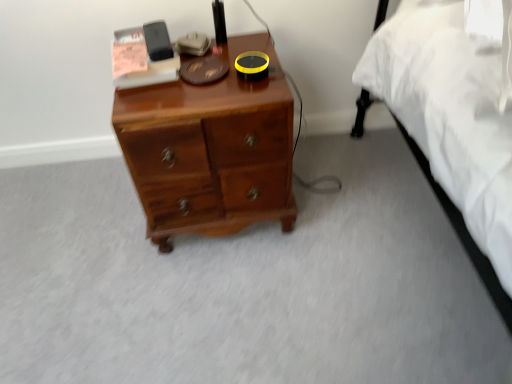
Image resolution: width=512 pixels, height=384 pixels. Identify the location of free location to the right of shiny wood chest of drawers at center. (342, 202).